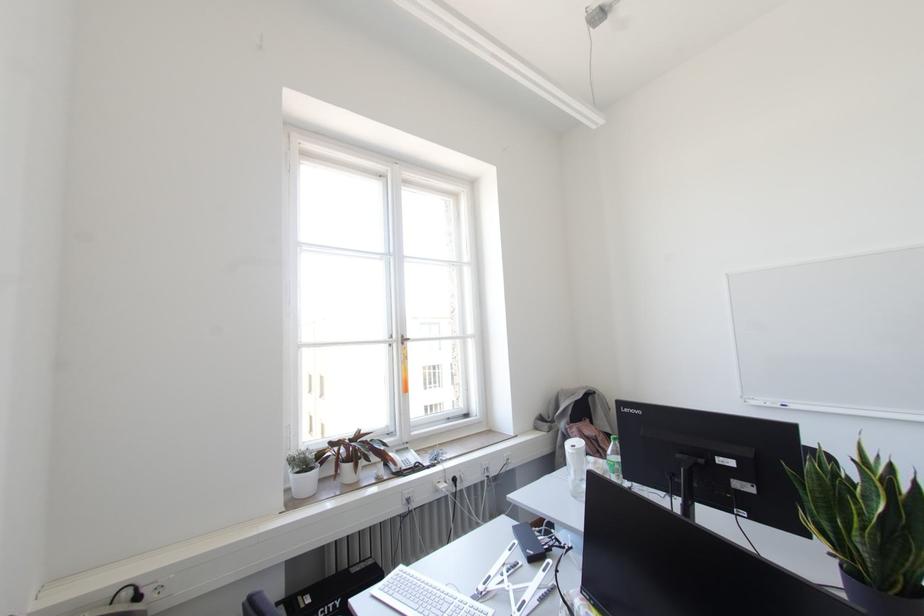
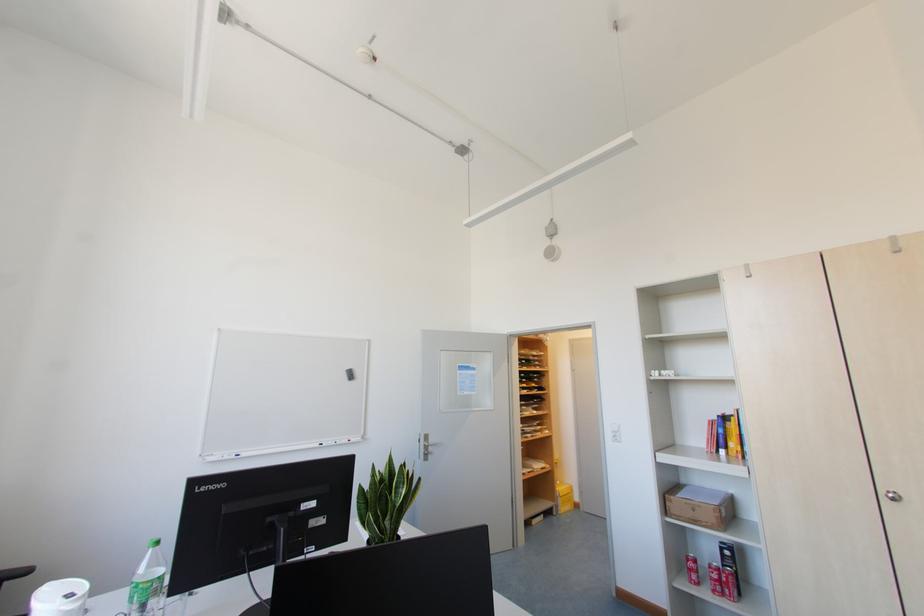
Question: The first image is from the beginning of the video and the second image is from the end. How did the camera likely rotate when shooting the video?

Choices:
 (A) Left
 (B) Right
 (C) Up
 (D) Down

Answer: (B)